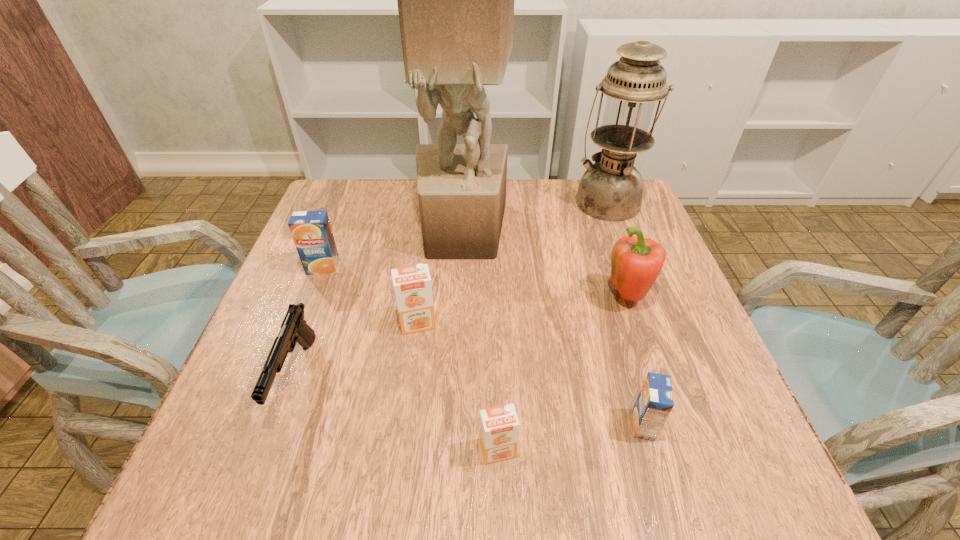
Image resolution: width=960 pixels, height=540 pixels. Find the location of `sculpture`. sculpture is located at coordinates (455, 0).

Where is `gray sculpture`? gray sculpture is located at coordinates (455, 0).

What are the coordinates of `the seventh shortest object` in the screenshot? It's located at (611, 189).

Locate an element on the screen. pepper is located at coordinates (636, 263).

The width and height of the screenshot is (960, 540). Identify the location of the third tallest object. [636, 263].

The width and height of the screenshot is (960, 540). Identify the location of the farthest orange juice. (311, 230).

Where is `the leftmost orange juice`? The width and height of the screenshot is (960, 540). the leftmost orange juice is located at coordinates (311, 230).

Locate an element on the screen. This screenshot has height=540, width=960. the second farthest orange juice is located at coordinates (412, 285).

Find the location of a particular element. the farther orange orange juice is located at coordinates (412, 285).

Locate an element on the screen. The width and height of the screenshot is (960, 540). black gun is located at coordinates (294, 329).